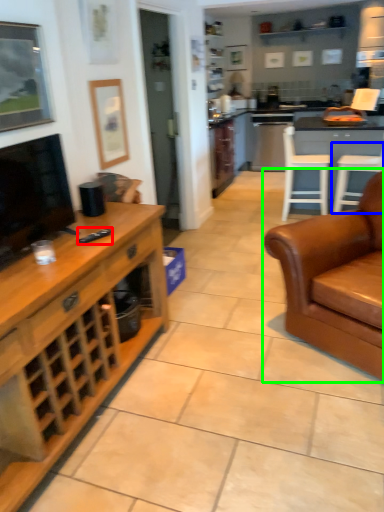
Question: Based on their relative distances, which object is farther from remote (highlighted by a red box)? Choose from chair (highlighted by a blue box) and studio couch (highlighted by a green box).

Choices:
 (A) chair
 (B) studio couch

Answer: (A)